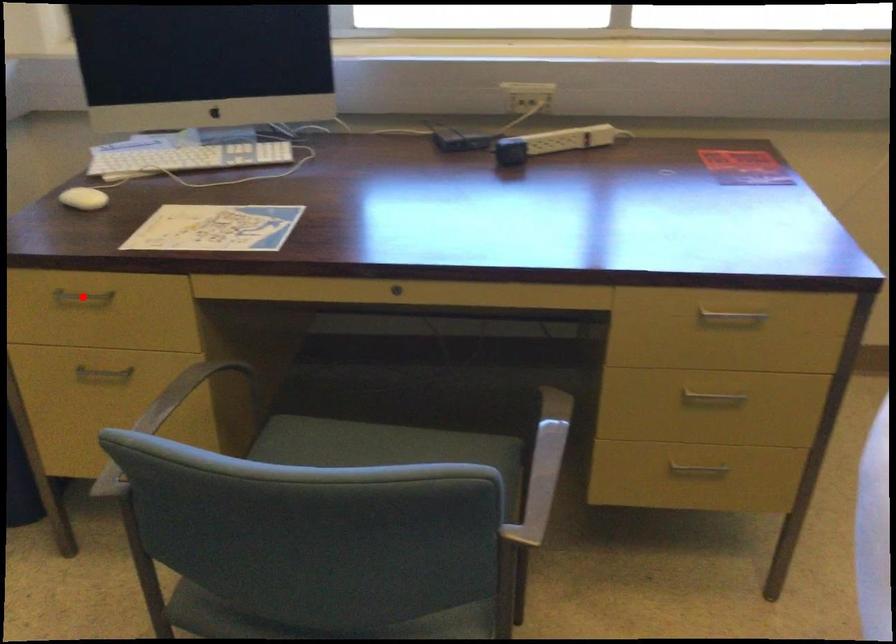
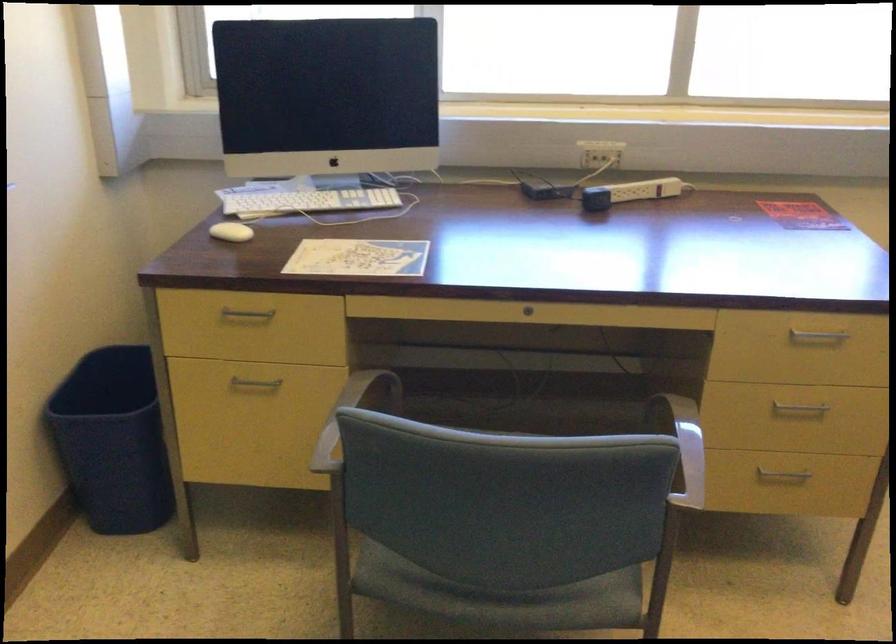
Locate, in the second image, the point that corresponds to the highlighted location in the first image.

(247, 313)